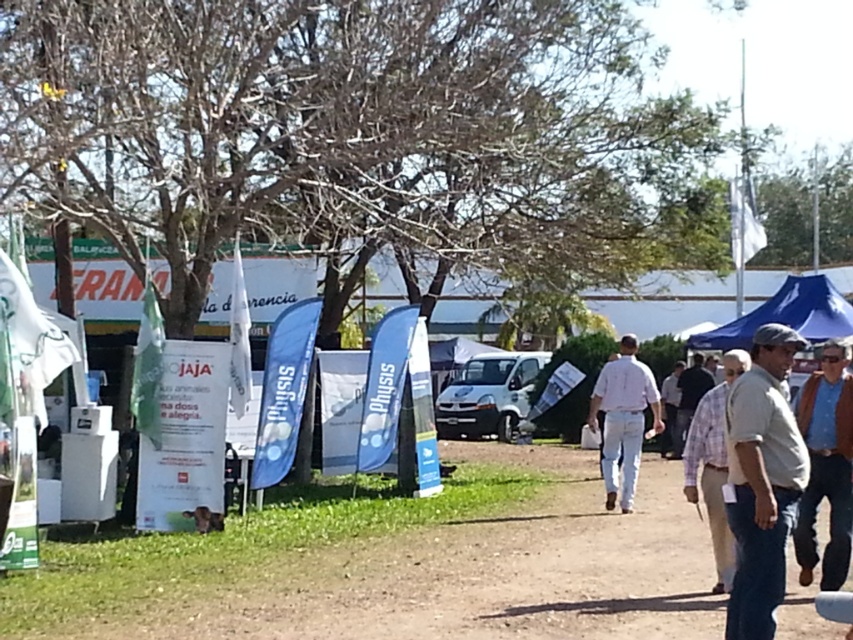
You are a photographer standing at the center of the dirt pathway. You want to take a photo of the gray cotton shirt at right. Where should you position yourself to capture the shirt in the frame?

To capture the gray cotton shirt at right in the frame, position yourself so that the shirt is centered at point 0.753 on the horizontal axis and 0.894 on the vertical axis of your camera viewfinder.

You are at the fair and want to find the white cotton shirt at center. According to the coordinates given, where exactly is it located?

The white cotton shirt at center is located at point 0.655 on the x axis and 0.732 on the y axis.

You are a photographer at the fair and want to capture both the brown leather jacket at lower right and the white cotton shirt at center in a single shot. Which direction should you move to ensure both are in frame?

You should move to the left to ensure both the brown leather jacket at lower right and the white cotton shirt at center are in frame, as the brown leather jacket at lower right is positioned to the right of the white cotton shirt at center.